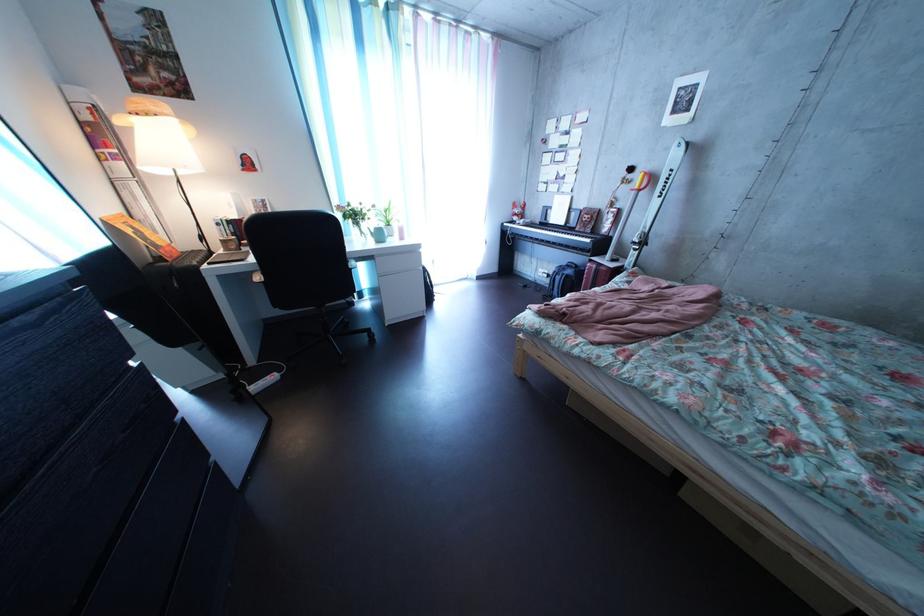
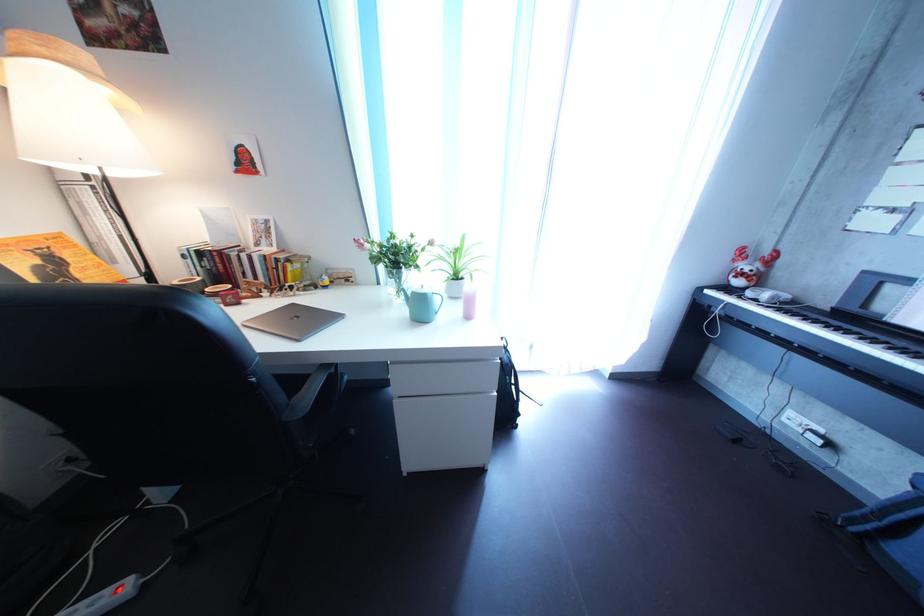
Locate, in the second image, the point that corresponds to [403,233] in the first image.

(469, 285)